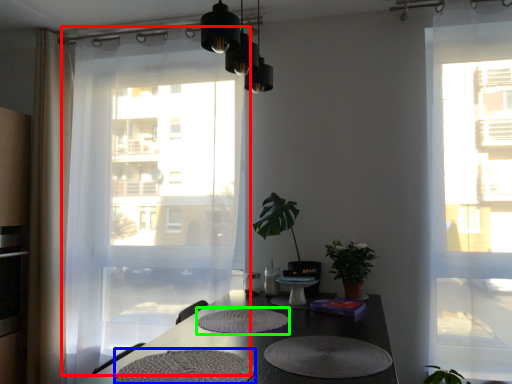
Question: Based on their relative distances, which object is nearer to curtain (highlighted by a red box)? Choose from wide (highlighted by a blue box) and mat (highlighted by a green box).

Choices:
 (A) wide
 (B) mat

Answer: (B)